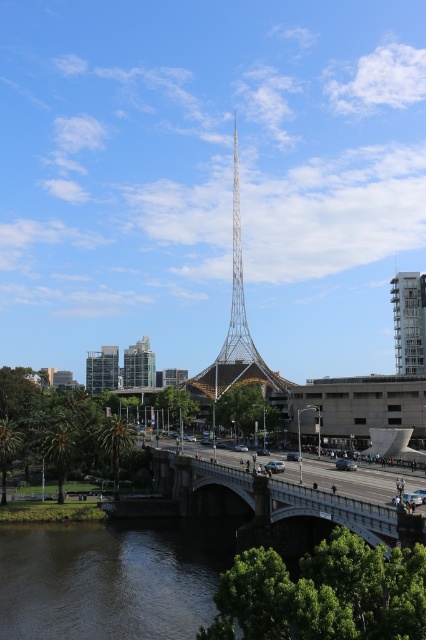
You are an architect designing a new pathway between the white stone bridge at center and the glassy modern building at center. Considering their widths, which structure should the pathway be closer to for better accessibility?

The white stone bridge at center is wider than the glassy modern building at center. Therefore, the pathway should be closer to the glassy modern building at center to ensure better accessibility by utilizing the wider space of the bridge for smoother movement.

You are a tourist standing at the base of the metallic lattice tower at center and want to cross the white stone bridge at center to reach the other side. Given that the bridge is 100 feet long, can you walk directly from the tower to the bridge without needing to backtrack?

The white stone bridge at center is 250.75 feet away from the metallic lattice tower at center. Since the bridge is only 100 feet long, you would need to walk towards the bridge from the tower, but the distance between them is greater than the bridge length. Therefore, you cannot walk directly from the tower to the bridge without backtracking as the bridge is not adjacent to the tower.

You are a drone operator planning to fly a drone between the two points marked as point (x=210, y=483). What is the minimum distance you need to set for the drone to safely navigate between them?

The minimum distance you need to set for the drone to safely navigate between the two points marked as point (x=210, y=483) is 83.32 meters.